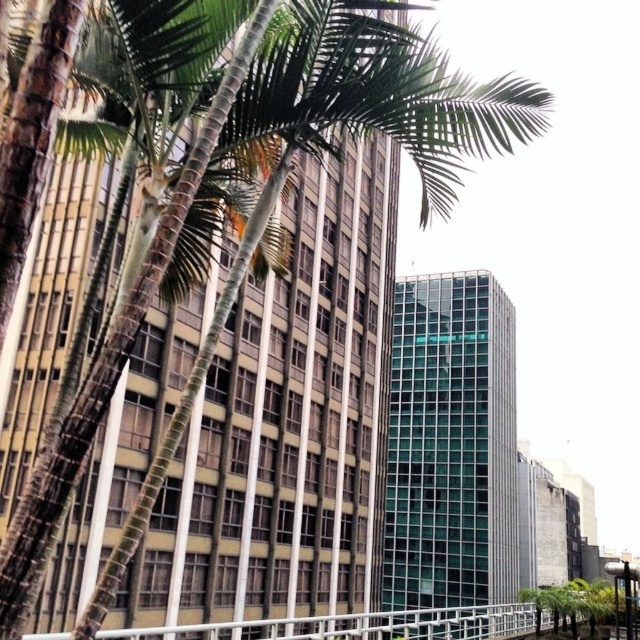
Question: Which point is closer to the camera?

Choices:
 (A) green leafy tree at lower right
 (B) white metal rail at lower center

Answer: (B)

Question: Which object appears closest to the camera in this image?

Choices:
 (A) white metal rail at lower center
 (B) green leafy tree at lower right

Answer: (A)

Question: Is white metal rail at lower center to the left of green leafy tree at lower right from the viewer's perspective?

Choices:
 (A) yes
 (B) no

Answer: (A)

Question: Which of the following is the closest to the observer?

Choices:
 (A) (637, 612)
 (B) (310, 620)

Answer: (B)

Question: Is white metal rail at lower center positioned at the back of green leafy tree at lower right?

Choices:
 (A) no
 (B) yes

Answer: (A)

Question: Is white metal rail at lower center to the left of green leafy tree at lower right from the viewer's perspective?

Choices:
 (A) no
 (B) yes

Answer: (B)